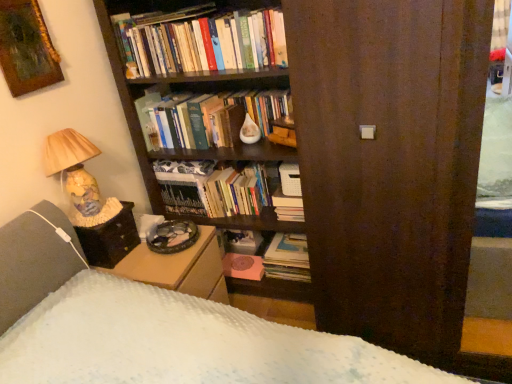
Question: From the image's perspective, is matte paper stack of books at center, marked as the 1th book in a bottom-to-top arrangement, over hardcover book at center, marked as the second book in a top-to-bottom arrangement?

Choices:
 (A) yes
 (B) no

Answer: (B)

Question: Considering the relative positions of matte paper stack of books at center, marked as the 1th book in a bottom-to-top arrangement, and hardcover book at center, marked as the second book in a top-to-bottom arrangement, in the image provided, is matte paper stack of books at center, marked as the 1th book in a bottom-to-top arrangement, to the right of hardcover book at center, marked as the second book in a top-to-bottom arrangement, from the viewer's perspective?

Choices:
 (A) no
 (B) yes

Answer: (B)

Question: Is matte paper stack of books at center, the fourth book when ordered from top to bottom, aimed at hardcover book at center, marked as the second book in a top-to-bottom arrangement?

Choices:
 (A) no
 (B) yes

Answer: (A)

Question: Considering the relative sizes of matte paper stack of books at center, the fourth book when ordered from top to bottom, and hardcover book at center, acting as the 3th book starting from the bottom, in the image provided, is matte paper stack of books at center, the fourth book when ordered from top to bottom, bigger than hardcover book at center, acting as the 3th book starting from the bottom,?

Choices:
 (A) no
 (B) yes

Answer: (A)

Question: From the image's perspective, is matte paper stack of books at center, marked as the 1th book in a bottom-to-top arrangement, below hardcover book at center, marked as the second book in a top-to-bottom arrangement?

Choices:
 (A) yes
 (B) no

Answer: (A)

Question: Is hardcover books at upper center, the 4th book in the bottom-to-top sequence, in front of or behind black fabric table at lower left in the image?

Choices:
 (A) front
 (B) behind

Answer: (B)

Question: Do you think hardcover books at upper center, the first book positioned from the top, is within black fabric table at lower left, or outside of it?

Choices:
 (A) outside
 (B) inside

Answer: (A)

Question: Is hardcover books at upper center, the first book positioned from the top, wider or thinner than black fabric table at lower left?

Choices:
 (A) thin
 (B) wide

Answer: (A)

Question: Is hardcover books at upper center, the first book positioned from the top, bigger or smaller than black fabric table at lower left?

Choices:
 (A) big
 (B) small

Answer: (A)

Question: From a real-world perspective, is brown wood screen door at center physically located above or below matte paper stack of books at center, the fourth book when ordered from top to bottom?

Choices:
 (A) below
 (B) above

Answer: (B)

Question: From their relative heights in the image, would you say brown wood screen door at center is taller or shorter than matte paper stack of books at center, marked as the 1th book in a bottom-to-top arrangement?

Choices:
 (A) short
 (B) tall

Answer: (B)

Question: Considering the relative positions of brown wood screen door at center and matte paper stack of books at center, the fourth book when ordered from top to bottom, in the image provided, is brown wood screen door at center to the left or to the right of matte paper stack of books at center, the fourth book when ordered from top to bottom,?

Choices:
 (A) right
 (B) left

Answer: (A)

Question: From the image's perspective, is brown wood screen door at center above or below matte paper stack of books at center, the fourth book when ordered from top to bottom?

Choices:
 (A) above
 (B) below

Answer: (A)

Question: From the image's perspective, relative to black fabric table at lower left, is brown wood screen door at center above or below?

Choices:
 (A) above
 (B) below

Answer: (A)

Question: Is brown wood screen door at center situated inside black fabric table at lower left or outside?

Choices:
 (A) outside
 (B) inside

Answer: (A)